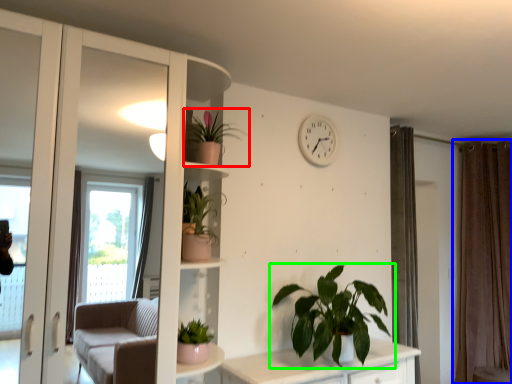
Question: Based on their relative distances, which object is nearer to houseplant (highlighted by a red box)? Choose from curtain (highlighted by a blue box) and houseplant (highlighted by a green box).

Choices:
 (A) curtain
 (B) houseplant

Answer: (B)